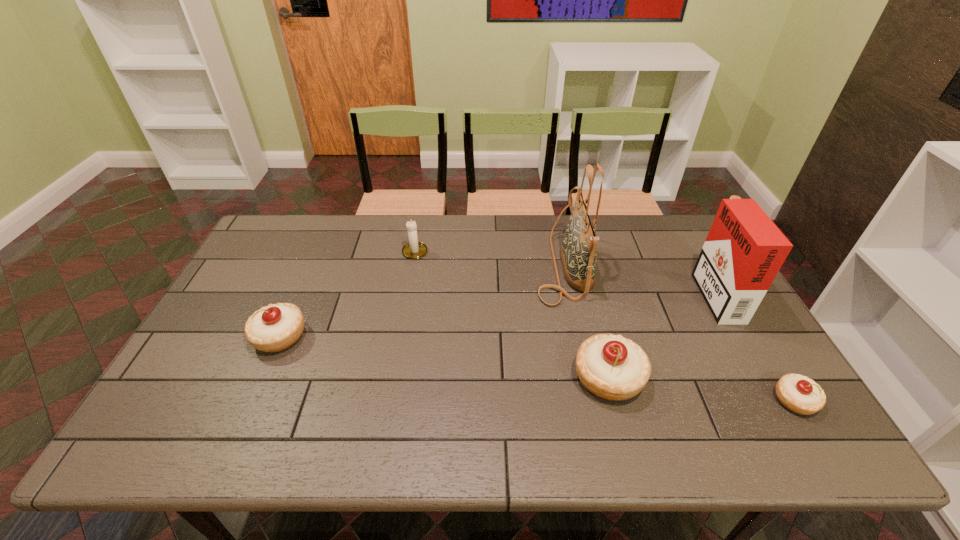
This screenshot has width=960, height=540. Find the location of `vacant space at the near left corner`. vacant space at the near left corner is located at coordinates (192, 403).

In the image, there is a desktop. Identify the location of vacant region at the near right corner. The image size is (960, 540). (747, 394).

You are a GUI agent. You are given a task and a screenshot of the screen. Output one action in this format:
    pyautogui.click(x=<x>, y=<y>)
    Task: Click on the free space that is in between the shortest object and the second shortest pastry
    This screenshot has width=960, height=540.
    Given the screenshot: What is the action you would take?
    pyautogui.click(x=538, y=368)

This screenshot has height=540, width=960. I want to click on vacant area between the fifth object from right to left and the rightmost pastry, so [605, 326].

Find the location of `vacant point located between the shortest object and the second pastry from left to right`. vacant point located between the shortest object and the second pastry from left to right is located at coordinates (702, 389).

Where is `empty space that is in between the second shortest pastry and the fifth shortest object`? empty space that is in between the second shortest pastry and the fifth shortest object is located at coordinates (497, 314).

You are a GUI agent. You are given a task and a screenshot of the screen. Output one action in this format:
    pyautogui.click(x=<x>, y=<y>)
    Task: Click on the vacant point located between the second pastry from left to right and the cigarette case
    
    Given the screenshot: What is the action you would take?
    pyautogui.click(x=661, y=335)

Identify the location of empty space between the second pastry from right to left and the second shortest object. Image resolution: width=960 pixels, height=540 pixels. (444, 357).

Locate an element on the screen. The height and width of the screenshot is (540, 960). free point between the shortest object and the fifth shortest object is located at coordinates (755, 346).

Locate an element on the screen. This screenshot has height=540, width=960. blank region between the handbag and the fifth object from right to left is located at coordinates (489, 258).